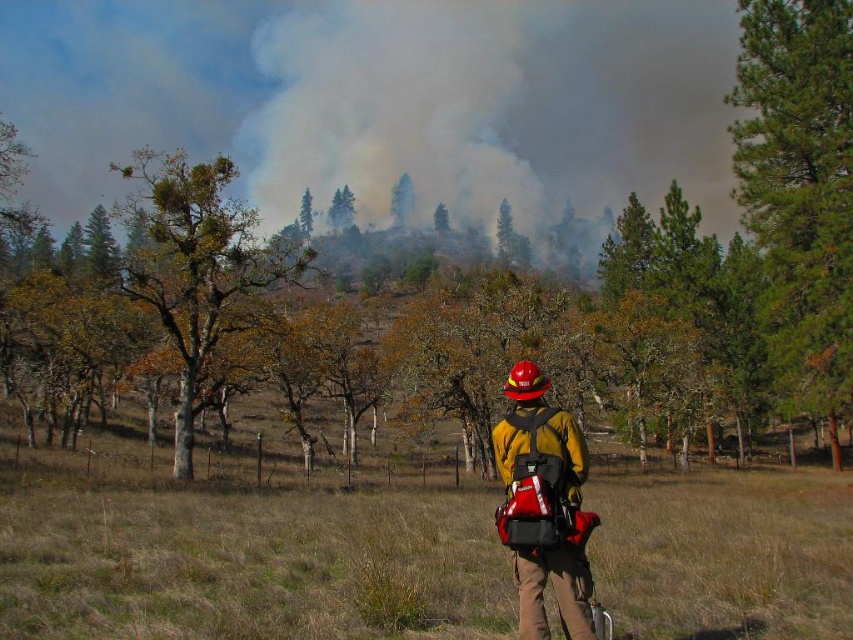
Based on the scene description, which tree is taller between the green matte tree at upper center and the green leafy tree at upper center?

The green matte tree at upper center is much taller than the green leafy tree at upper center.

Based on the scene description, where is the green pine tree at right positioned in the image?

The green pine tree at right is located at point 0.292 on the horizontal axis and 0.938 on the vertical axis.